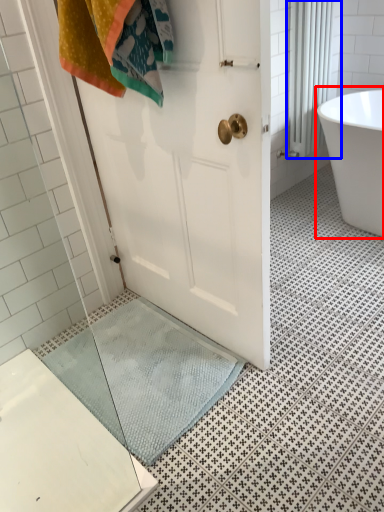
Question: Which object appears closest to the camera in this image, bathtub (highlighted by a red box) or shower curtain (highlighted by a blue box)?

Choices:
 (A) bathtub
 (B) shower curtain

Answer: (A)